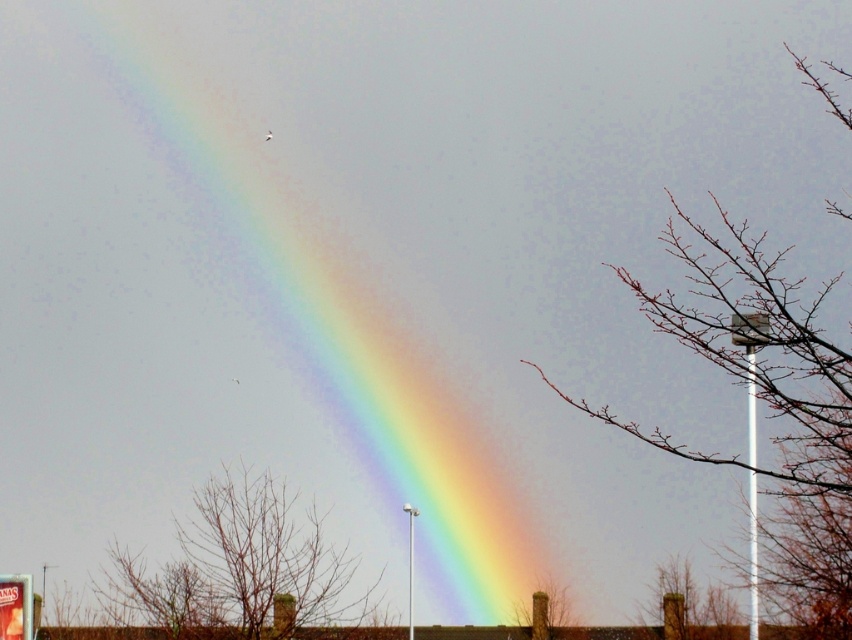
You are standing in a park and see the rainbow at upper center in the sky. If you want to take a photo of it using your smartphone, where should you point your camera?

You should point your camera towards the upper center of the sky where the rainbow at upper center is located.

You are standing in a park and see the brown textured tree at lower right and the bare branches at lower center. Which one appears taller in the image?

The brown textured tree at lower right is much taller than the bare branches at lower center in the image.